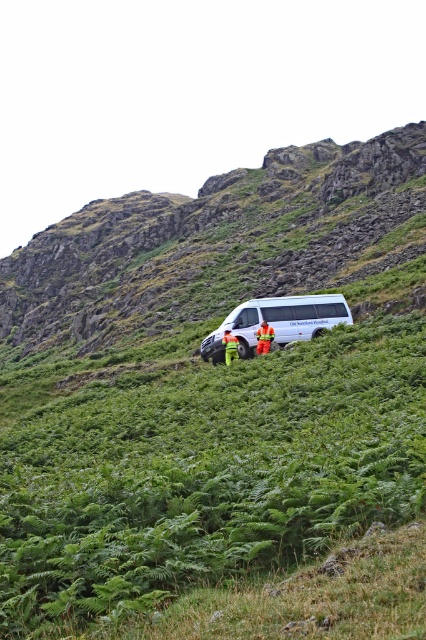
Question: Which of the following is the closest to the observer?

Choices:
 (A) white matte van at center
 (B) green leafy grass at center
 (C) rough stone mountain at center

Answer: (B)

Question: Does white matte van at center appear over orange fabric pants at center?

Choices:
 (A) yes
 (B) no

Answer: (A)

Question: Which point is farther from the camera taking this photo?

Choices:
 (A) (227, 342)
 (B) (265, 346)

Answer: (A)

Question: Is reflective orange vest at center to the right of orange fabric pants at center from the viewer's perspective?

Choices:
 (A) yes
 (B) no

Answer: (A)

Question: Which point appears closest to the camera in this image?

Choices:
 (A) (290, 179)
 (B) (140, 540)
 (C) (233, 337)

Answer: (B)

Question: Is green leafy grass at center positioned behind rough stone mountain at center?

Choices:
 (A) no
 (B) yes

Answer: (A)